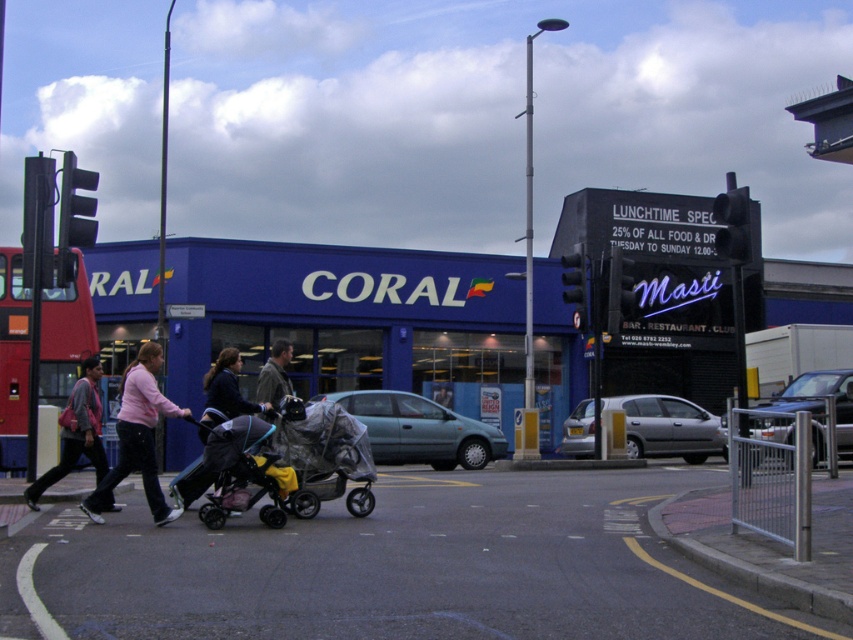
You are a pedestrian waiting at the zebra crossing in the image. You need to cross the road safely. The red metallic bus at left and the silver metallic hatchback at center are both in your path. Which vehicle should you avoid first to ensure your safety?

The red metallic bus at left is positioned over the silver metallic hatchback at center, meaning it is closer to you. Therefore, you should first avoid the red metallic bus at left to ensure your safety.